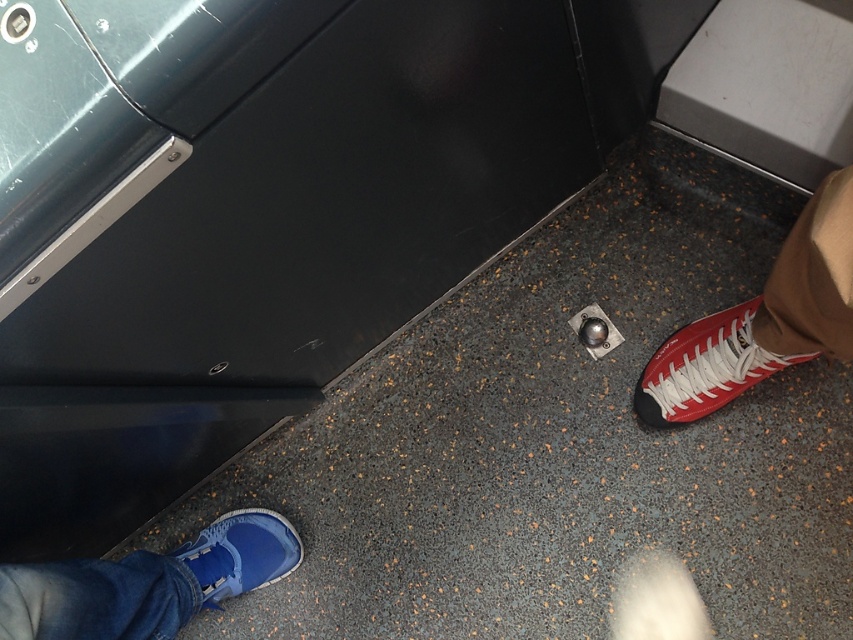
You are standing in an elevator and notice two pairs of sneakers at the bottom. The red leather sneaker at lower right and the matte blue sneaker at lower left. Which one has a bigger size?

The red leather sneaker at lower right has a larger size compared to the matte blue sneaker at lower left.

You are standing in an elevator and want to move from the blue suede shoe at lower left to the red leather sneaker at lower right. How many steps would you need to take if each step covers approximately 30 centimeters?

The blue suede shoe at lower left and red leather sneaker at lower right are 72.19 centimeters apart. Since each step covers about 30 centimeters, you would need to take 3 steps to cover the distance between them.

You are designing a shoe rack for an elevator. The blue suede shoe at lower left and the red leather sneaker at lower right are both to be placed on the rack. Given their sizes, which shoe should be placed in the larger compartment?

The blue suede shoe at lower left has a larger size compared to the red leather sneaker at lower right, so the larger compartment should be allocated for the blue suede shoe at lower left.